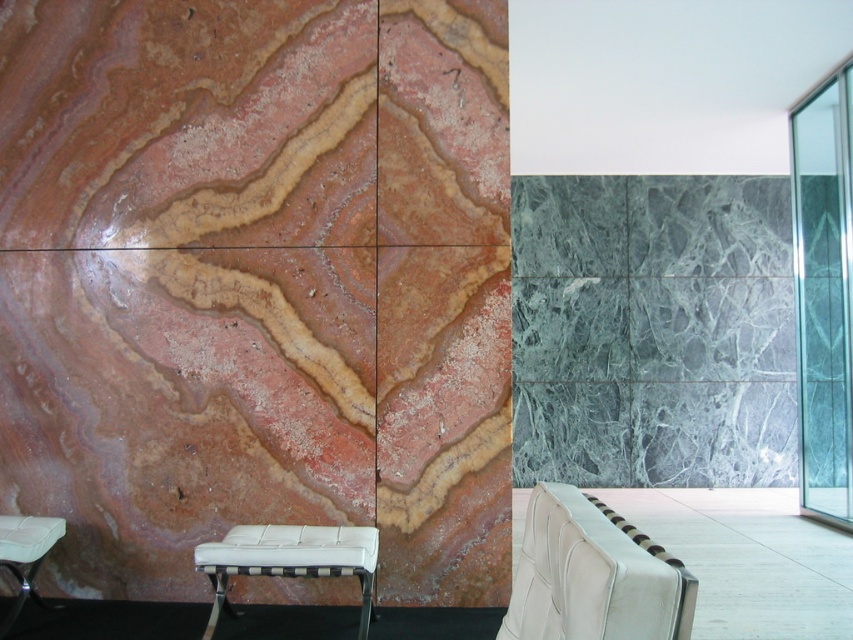
You are a guest entering the room and see the transparent glass door at right and the white leather chair at center. Which object is closer to you from your current position?

The transparent glass door at right is closer to you than the white leather chair at center because the white leather chair at center is behind the transparent glass door at right.

You are planning to place a large potted plant between the white leather bench at lower center and the white leather stool at lower left. Given their sizes, which object should the plant be closer to to ensure it doesn

The white leather bench at lower center has a larger width than the white leather stool at lower left. To accommodate the large potted plant, it should be placed closer to the white leather bench at lower center since it offers more space.